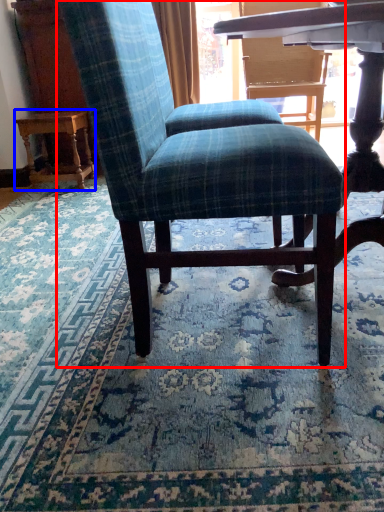
Question: Which object appears farthest to the camera in this image, chair (highlighted by a red box) or table (highlighted by a blue box)?

Choices:
 (A) chair
 (B) table

Answer: (B)